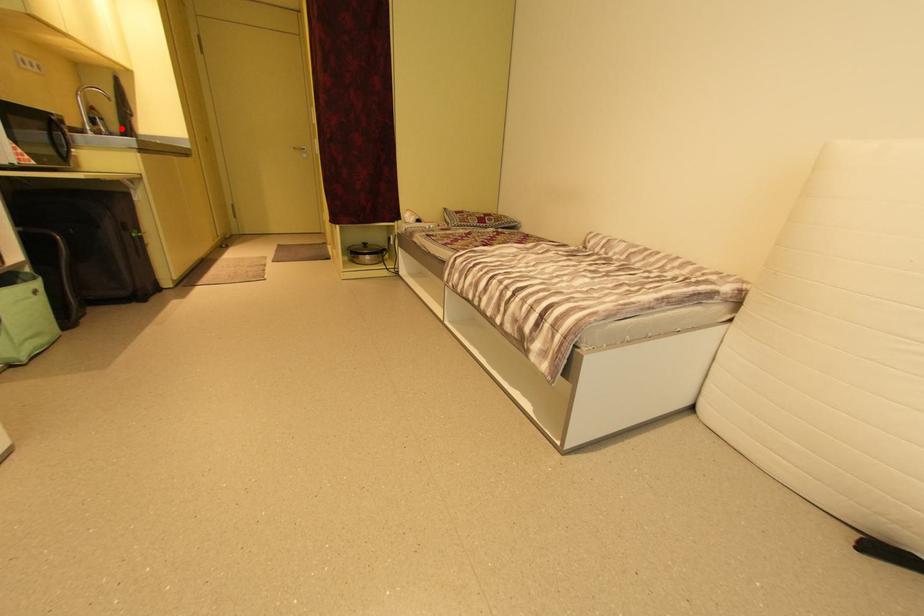
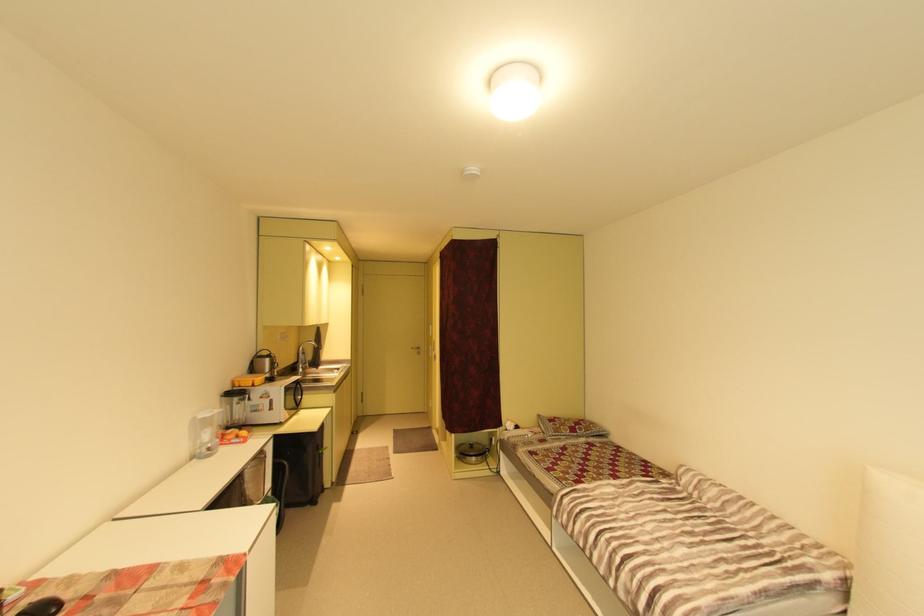
Where in the second image is the point corresponding to the highlighted location from the first image?

(317, 358)